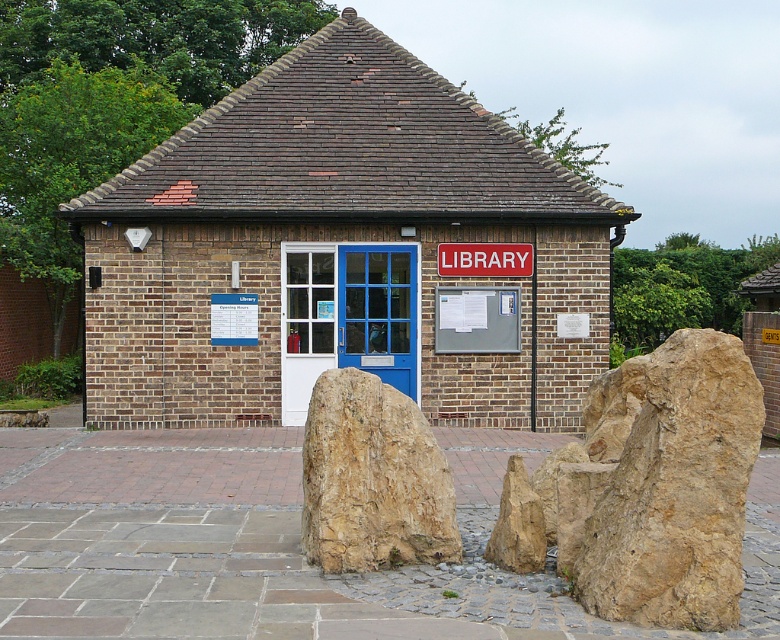
Which is more to the right, brown rough rock at lower right or brown rough rock at center?

From the viewer's perspective, brown rough rock at lower right appears more on the right side.

Can you confirm if brown rough rock at lower right is shorter than brown rough rock at center?

Incorrect, brown rough rock at lower right's height does not fall short of brown rough rock at center's.

Is point (654, 490) behind point (367, 481)?

No, (654, 490) is closer to viewer.

Find the location of a particular element. This screenshot has width=780, height=640. brown rough rock at lower right is located at coordinates (676, 492).

Between point (693, 451) and point (516, 257), which one is positioned in front?

Positioned in front is point (693, 451).

Does brown rough rock at lower right have a greater width compared to red plastic sign at center?

No.

Identify the location of brown rough rock at lower right. The width and height of the screenshot is (780, 640). pyautogui.click(x=676, y=492).

Locate an element on the screen. The height and width of the screenshot is (640, 780). brown rough rock at lower right is located at coordinates (676, 492).

Does brown rough rock at center have a lesser width compared to red plastic sign at center?

Indeed, brown rough rock at center has a lesser width compared to red plastic sign at center.

Is point (387, 493) positioned after point (470, 275)?

No.

I want to click on brown rough rock at center, so click(371, 477).